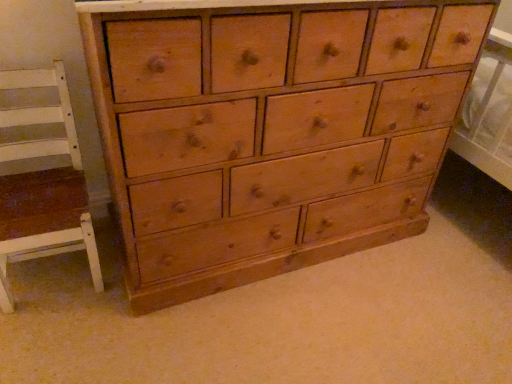
Where is `free point to the right of white painted wood chair at left`? free point to the right of white painted wood chair at left is located at coordinates (117, 298).